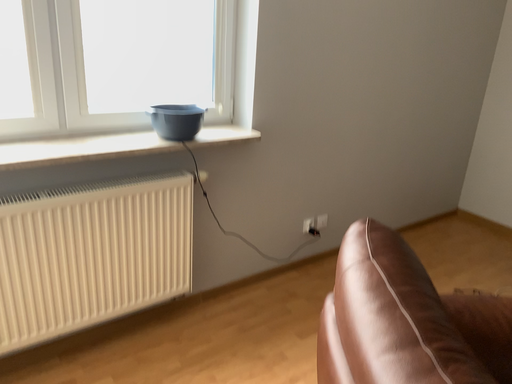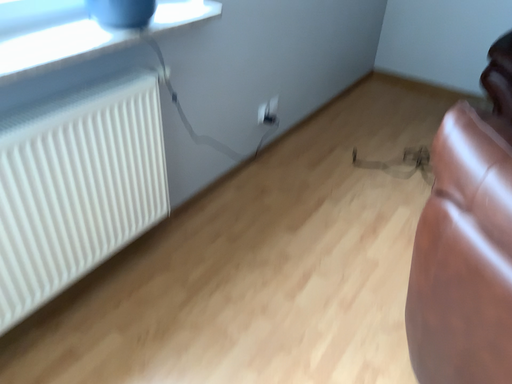
Question: Which way did the camera rotate in the video?

Choices:
 (A) rotated upward
 (B) rotated downward

Answer: (B)